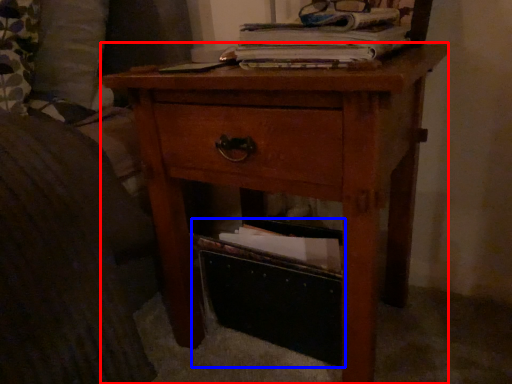
Question: Which object is closer to the camera taking this photo, nightstand (highlighted by a red box) or storage box (highlighted by a blue box)?

Choices:
 (A) nightstand
 (B) storage box

Answer: (A)